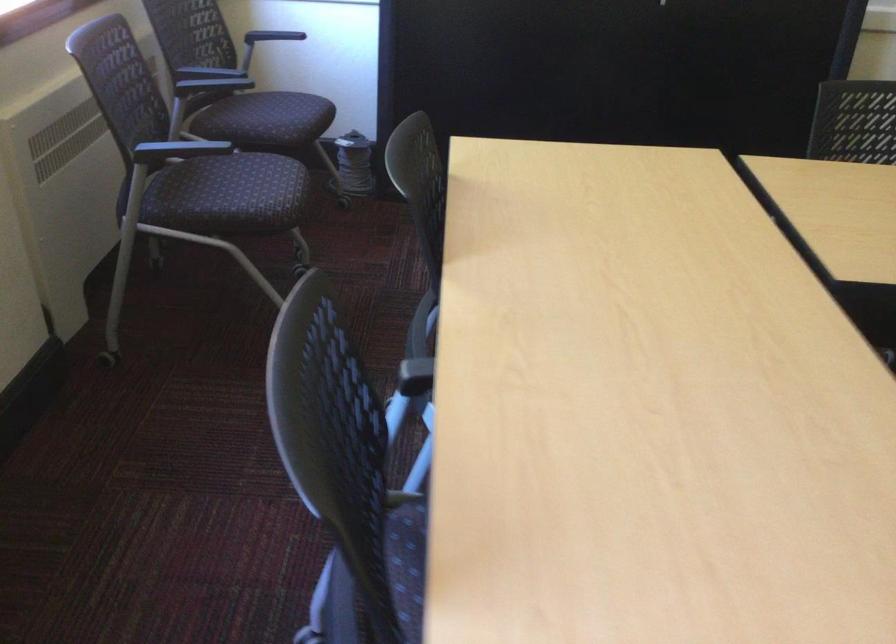
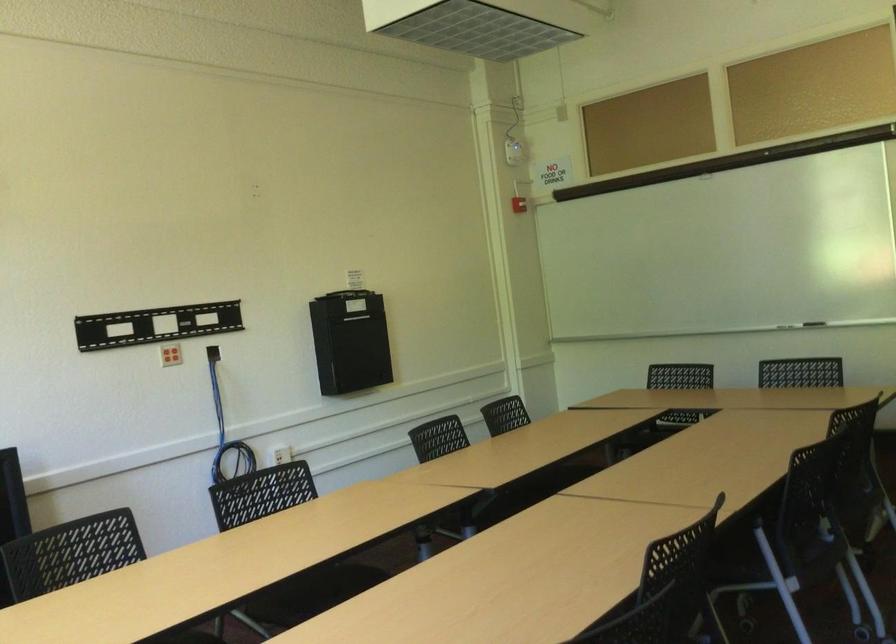
Question: The camera is either moving clockwise (left) or counter-clockwise (right) around the object. The first image is from the beginning of the video and the second image is from the end. Is the camera moving left or right when shooting the video?

Choices:
 (A) Left
 (B) Right

Answer: (A)